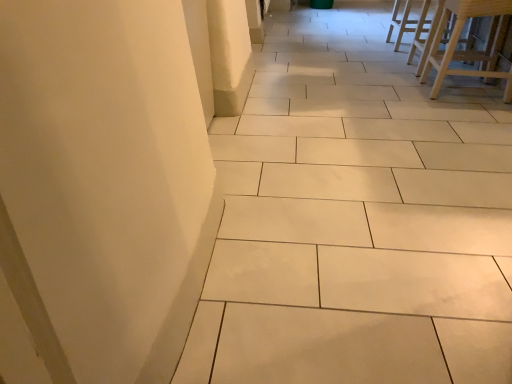
Question: Is light brown wooden stool at upper right, which is the second furniture in bottom-to-top order, shorter than light wood stool at upper right, which is the 1th furniture from front to back?

Choices:
 (A) yes
 (B) no

Answer: (A)

Question: Does light brown wooden stool at upper right, arranged as the 2th furniture when viewed from the front, lie behind light wood stool at upper right, which appears as the 1th furniture when ordered from the bottom?

Choices:
 (A) no
 (B) yes

Answer: (B)

Question: Can you confirm if light brown wooden stool at upper right, the first furniture in the top-to-bottom sequence, is bigger than light wood stool at upper right, which appears as the 1th furniture when ordered from the bottom?

Choices:
 (A) no
 (B) yes

Answer: (A)

Question: Considering the relative sizes of light brown wooden stool at upper right, the first furniture in the top-to-bottom sequence, and light wood stool at upper right, which is the 1th furniture from front to back, in the image provided, is light brown wooden stool at upper right, the first furniture in the top-to-bottom sequence, taller than light wood stool at upper right, which is the 1th furniture from front to back,?

Choices:
 (A) yes
 (B) no

Answer: (B)

Question: Does light brown wooden stool at upper right, arranged as the 2th furniture when viewed from the front, have a lesser width compared to light wood stool at upper right, arranged as the 2th furniture when viewed from the back?

Choices:
 (A) yes
 (B) no

Answer: (A)

Question: Considering the relative positions of light brown wooden stool at upper right, arranged as the 2th furniture when viewed from the front, and light wood stool at upper right, arranged as the 2th furniture when viewed from the back, in the image provided, is light brown wooden stool at upper right, arranged as the 2th furniture when viewed from the front, to the left of light wood stool at upper right, arranged as the 2th furniture when viewed from the back, from the viewer's perspective?

Choices:
 (A) yes
 (B) no

Answer: (B)

Question: Does light wood stool at upper right, arranged as the 2th furniture when viewed from the back, come in front of light brown wooden stool at upper right, arranged as the 2th furniture when viewed from the front?

Choices:
 (A) no
 (B) yes

Answer: (B)

Question: Considering the relative positions of light wood stool at upper right, which is the 1th furniture from front to back, and light brown wooden stool at upper right, which is the second furniture in bottom-to-top order, in the image provided, is light wood stool at upper right, which is the 1th furniture from front to back, to the right of light brown wooden stool at upper right, which is the second furniture in bottom-to-top order, from the viewer's perspective?

Choices:
 (A) no
 (B) yes

Answer: (A)

Question: Is light wood stool at upper right, the second furniture from the top, further to camera compared to light brown wooden stool at upper right, which appears as the 1th furniture when viewed from the back?

Choices:
 (A) yes
 (B) no

Answer: (B)

Question: Can you confirm if light wood stool at upper right, which appears as the 1th furniture when ordered from the bottom, is smaller than light brown wooden stool at upper right, which appears as the 1th furniture when viewed from the back?

Choices:
 (A) no
 (B) yes

Answer: (A)

Question: Can you confirm if light wood stool at upper right, which is the 1th furniture from front to back, is taller than light brown wooden stool at upper right, which is the second furniture in bottom-to-top order?

Choices:
 (A) no
 (B) yes

Answer: (B)

Question: From a real-world perspective, is light wood stool at upper right, arranged as the 2th furniture when viewed from the back, on light brown wooden stool at upper right, which is the second furniture in bottom-to-top order?

Choices:
 (A) yes
 (B) no

Answer: (A)

Question: In the image, is light wood stool at upper right, which appears as the 1th furniture when ordered from the bottom, positioned in front of or behind light brown wooden stool at upper right, which is the second furniture in bottom-to-top order?

Choices:
 (A) front
 (B) behind

Answer: (A)